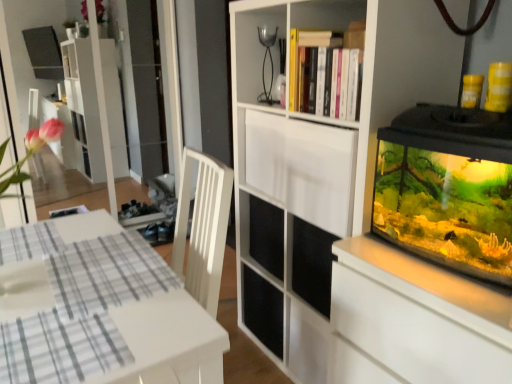
Question: From a real-world perspective, is white glossy table at lower left over white matte cabinet at upper center?

Choices:
 (A) no
 (B) yes

Answer: (A)

Question: Considering the relative sizes of white glossy table at lower left and white matte cabinet at upper center in the image provided, is white glossy table at lower left thinner than white matte cabinet at upper center?

Choices:
 (A) no
 (B) yes

Answer: (A)

Question: Does white glossy table at lower left have a greater height compared to white matte cabinet at upper center?

Choices:
 (A) yes
 (B) no

Answer: (A)

Question: Are white glossy table at lower left and white matte cabinet at upper center located far from each other?

Choices:
 (A) yes
 (B) no

Answer: (B)

Question: Considering the relative positions of white glossy table at lower left and white matte cabinet at upper center in the image provided, is white glossy table at lower left to the right of white matte cabinet at upper center from the viewer's perspective?

Choices:
 (A) yes
 (B) no

Answer: (B)

Question: From a real-world perspective, is white glossy table at lower left positioned under white matte cabinet at upper center based on gravity?

Choices:
 (A) yes
 (B) no

Answer: (A)

Question: Is white matte cabinet at upper center oriented towards white matte cupboard at center?

Choices:
 (A) yes
 (B) no

Answer: (A)

Question: Does white matte cabinet at upper center have a smaller size compared to white matte cupboard at center?

Choices:
 (A) yes
 (B) no

Answer: (A)

Question: Is white matte cabinet at upper center turned away from white matte cupboard at center?

Choices:
 (A) yes
 (B) no

Answer: (A)

Question: From a real-world perspective, does white matte cabinet at upper center stand above white matte cupboard at center?

Choices:
 (A) no
 (B) yes

Answer: (B)

Question: Would you say white matte cupboard at center is part of white matte cabinet at upper center's contents?

Choices:
 (A) no
 (B) yes

Answer: (A)

Question: Can you confirm if white matte cabinet at upper center is positioned to the right of white matte cupboard at center?

Choices:
 (A) yes
 (B) no

Answer: (B)

Question: Does white matte cupboard at center have a smaller size compared to white glossy table at lower left?

Choices:
 (A) yes
 (B) no

Answer: (B)